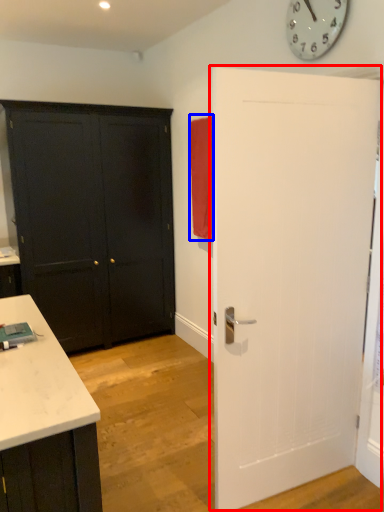
Question: Which of the following is the farthest to the observer, door (highlighted by a red box) or curtain (highlighted by a blue box)?

Choices:
 (A) door
 (B) curtain

Answer: (B)